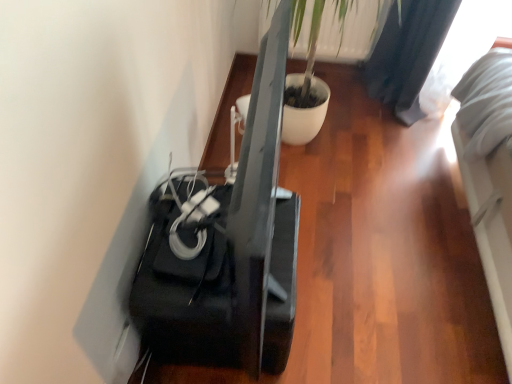
Identify the location of vacant space underneath green leafy plant at upper center (from a real-world perspective). This screenshot has width=512, height=384. (336, 73).